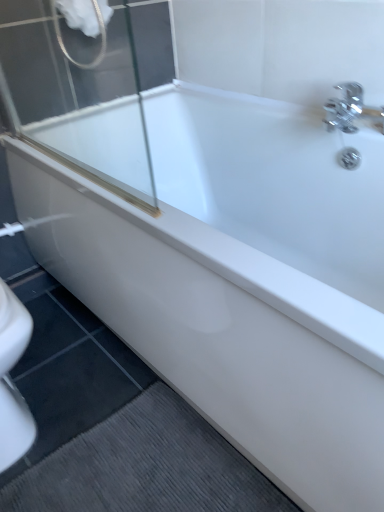
Where is `blank space situated above gray textured bath mat at lower left (from a real-world perspective)`? The height and width of the screenshot is (512, 384). blank space situated above gray textured bath mat at lower left (from a real-world perspective) is located at coordinates (134, 470).